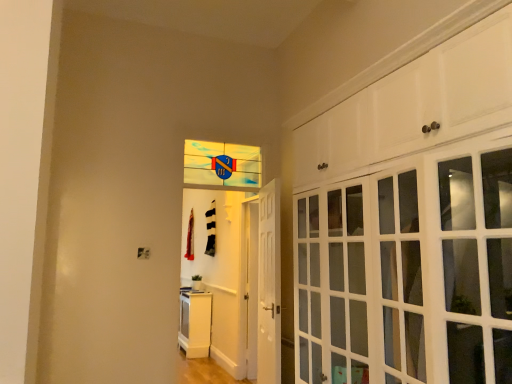
Question: Does white glossy cabinet at lower left, the 2th cabinetry positioned from the right, have a lesser height compared to white glossy door at center?

Choices:
 (A) no
 (B) yes

Answer: (B)

Question: Is white glossy cabinet at lower left, which is the first cabinetry in left-to-right order, far from white glossy door at center?

Choices:
 (A) no
 (B) yes

Answer: (B)

Question: Does white glossy cabinet at lower left, the first cabinetry when ordered from bottom to top, have a greater height compared to white glossy door at center?

Choices:
 (A) yes
 (B) no

Answer: (B)

Question: Is white glossy door at center located within white glossy cabinet at lower left, the 2th cabinetry in the front-to-back sequence?

Choices:
 (A) no
 (B) yes

Answer: (A)

Question: From a real-world perspective, does white glossy cabinet at lower left, the 2th cabinetry in the front-to-back sequence, stand above white glossy door at center?

Choices:
 (A) no
 (B) yes

Answer: (A)

Question: Is translucent glass window at center wider or thinner than white glossy door at center?

Choices:
 (A) wide
 (B) thin

Answer: (B)

Question: Is translucent glass window at center bigger or smaller than white glossy door at center?

Choices:
 (A) small
 (B) big

Answer: (A)

Question: Is translucent glass window at center taller or shorter than white glossy door at center?

Choices:
 (A) short
 (B) tall

Answer: (A)

Question: Considering their positions, is translucent glass window at center located in front of or behind white glossy door at center?

Choices:
 (A) front
 (B) behind

Answer: (B)

Question: Is white glossy cabinet doors at upper right, which is counted as the second cabinetry, starting from the bottom, in front of or behind translucent glass window at center in the image?

Choices:
 (A) front
 (B) behind

Answer: (A)

Question: From the image's perspective, is white glossy cabinet doors at upper right, which is counted as the second cabinetry, starting from the bottom, positioned above or below translucent glass window at center?

Choices:
 (A) above
 (B) below

Answer: (B)

Question: From a real-world perspective, is white glossy cabinet doors at upper right, which is counted as the second cabinetry, starting from the bottom, above or below translucent glass window at center?

Choices:
 (A) below
 (B) above

Answer: (A)

Question: Would you say white glossy cabinet doors at upper right, marked as the 1th cabinetry in a front-to-back arrangement, is inside or outside translucent glass window at center?

Choices:
 (A) inside
 (B) outside

Answer: (B)

Question: From the image's perspective, relative to white glossy cabinet at lower left, the 2th cabinetry in the front-to-back sequence, is translucent glass window at center above or below?

Choices:
 (A) above
 (B) below

Answer: (A)

Question: Is translucent glass window at center bigger or smaller than white glossy cabinet at lower left, which is the first cabinetry in left-to-right order?

Choices:
 (A) big
 (B) small

Answer: (B)